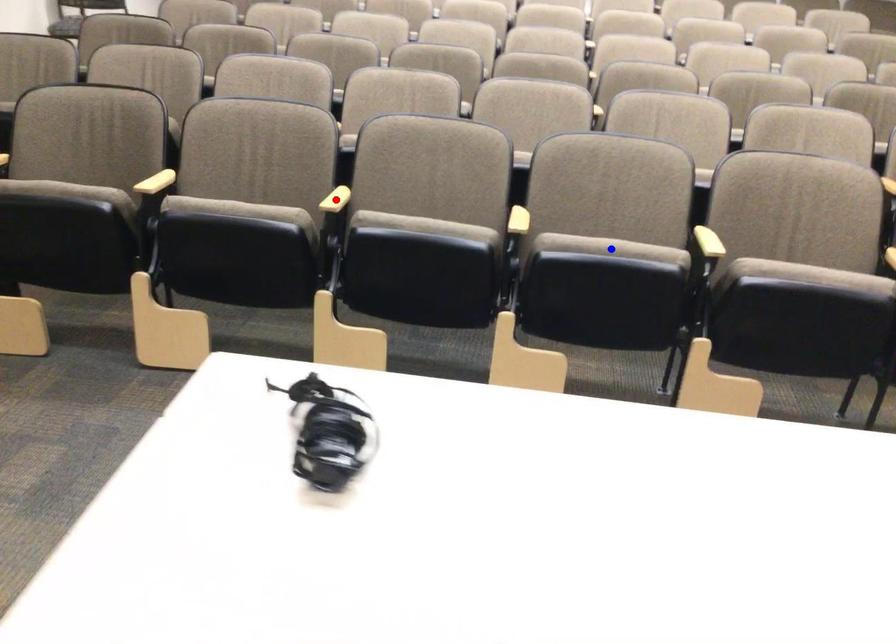
Question: Two points are marked on the image. Which point is closer to the camera?

Choices:
 (A) Blue point is closer.
 (B) Red point is closer.

Answer: (A)